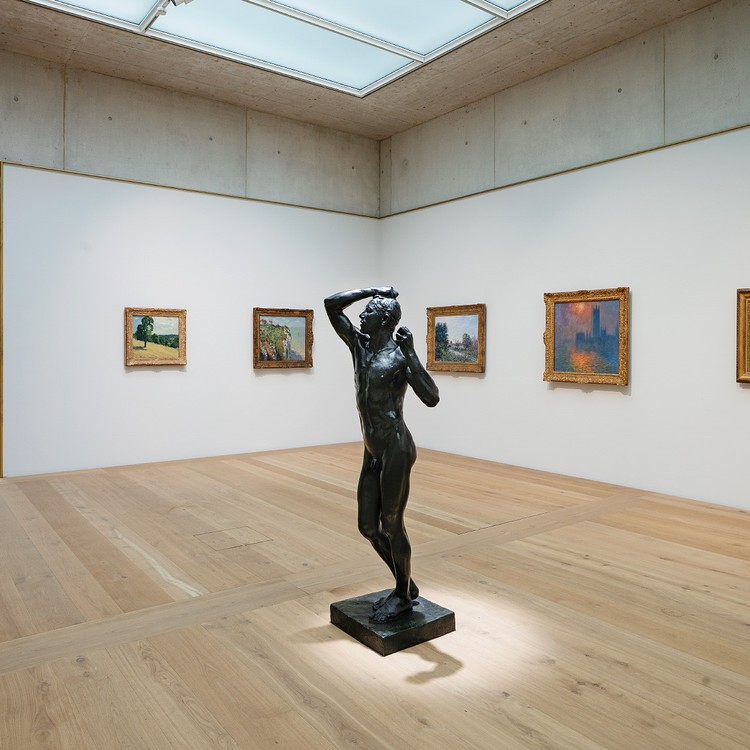
Locate an element on the screen. spotlight is located at coordinates (475, 630).